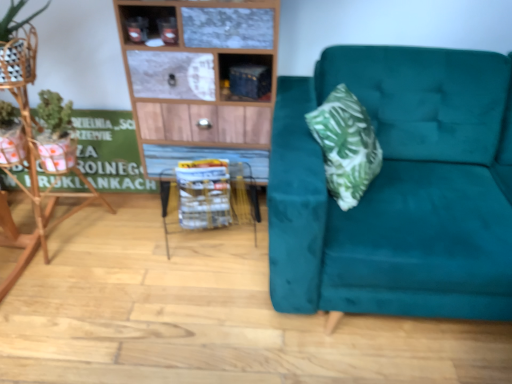
The width and height of the screenshot is (512, 384). Identify the location of vacant area that lies between teal velvet couch at right and metallic wireframe table at center. (231, 270).